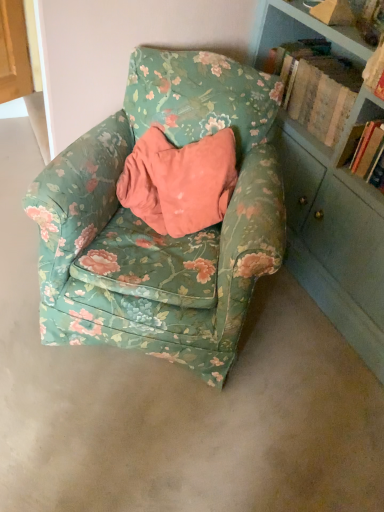
Question: Could hardcover book at right, positioned as the 1th book in bottom-to-top order, be considered to be inside wooden book at upper right, the first book from the top?

Choices:
 (A) no
 (B) yes

Answer: (A)

Question: Is wooden book at upper right, positioned as the 2th book in bottom-to-top order, smaller than hardcover book at right, acting as the 2th book starting from the top?

Choices:
 (A) no
 (B) yes

Answer: (A)

Question: Is wooden book at upper right, positioned as the 2th book in bottom-to-top order, thinner than hardcover book at right, positioned as the 1th book in bottom-to-top order?

Choices:
 (A) no
 (B) yes

Answer: (A)

Question: Does wooden book at upper right, positioned as the 2th book in bottom-to-top order, appear on the left side of hardcover book at right, positioned as the 1th book in bottom-to-top order?

Choices:
 (A) no
 (B) yes

Answer: (B)

Question: Is wooden book at upper right, positioned as the 2th book in bottom-to-top order, bigger than hardcover book at right, positioned as the 1th book in bottom-to-top order?

Choices:
 (A) no
 (B) yes

Answer: (B)

Question: Could you tell me if wooden book at upper right, the first book from the top, is turned towards hardcover book at right, acting as the 2th book starting from the top?

Choices:
 (A) yes
 (B) no

Answer: (B)

Question: From a real-world perspective, is floral fabric armchair at center located beneath wooden book at upper right, positioned as the 2th book in bottom-to-top order?

Choices:
 (A) yes
 (B) no

Answer: (A)

Question: Considering the relative sizes of floral fabric armchair at center and wooden book at upper right, the first book from the top, in the image provided, is floral fabric armchair at center taller than wooden book at upper right, the first book from the top,?

Choices:
 (A) no
 (B) yes

Answer: (B)

Question: Are floral fabric armchair at center and wooden book at upper right, positioned as the 2th book in bottom-to-top order, far apart?

Choices:
 (A) no
 (B) yes

Answer: (A)

Question: Is floral fabric armchair at center at the left side of wooden book at upper right, positioned as the 2th book in bottom-to-top order?

Choices:
 (A) yes
 (B) no

Answer: (A)

Question: From a real-world perspective, is floral fabric armchair at center physically above wooden book at upper right, the first book from the top?

Choices:
 (A) yes
 (B) no

Answer: (B)

Question: Is floral fabric armchair at center aimed at wooden book at upper right, the first book from the top?

Choices:
 (A) no
 (B) yes

Answer: (A)

Question: Considering the relative sizes of floral fabric armchair at center and hardcover book at right, positioned as the 1th book in bottom-to-top order, in the image provided, is floral fabric armchair at center bigger than hardcover book at right, positioned as the 1th book in bottom-to-top order,?

Choices:
 (A) yes
 (B) no

Answer: (A)